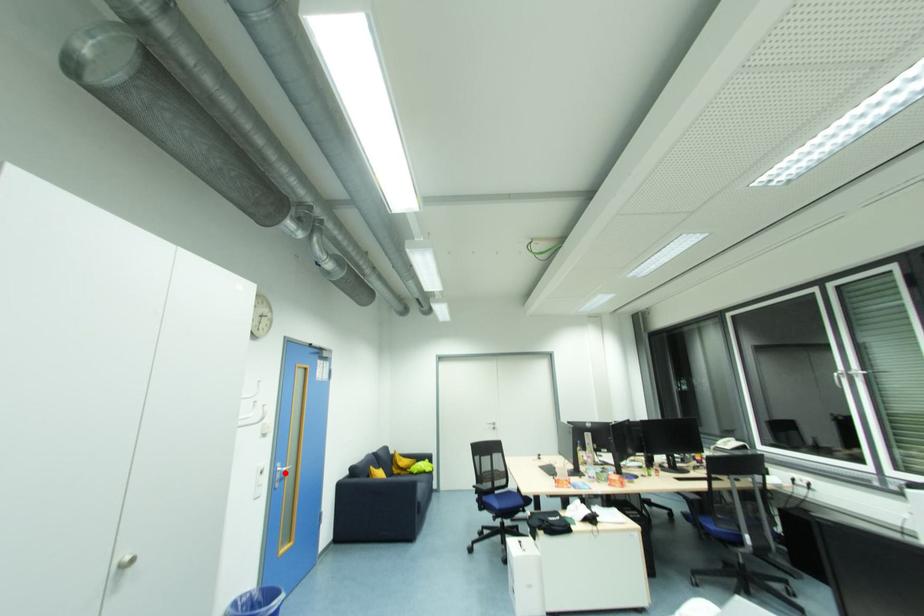
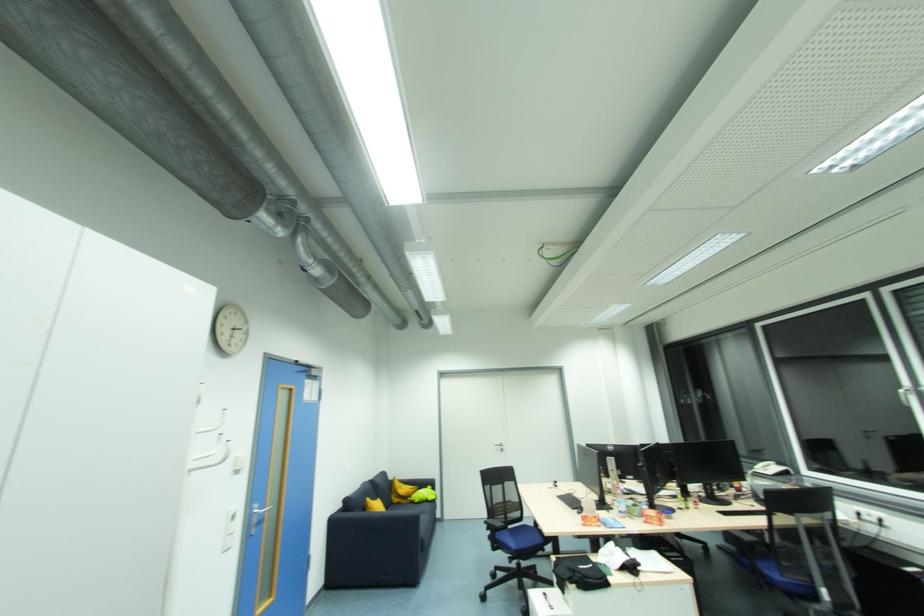
In the second image, find the point that corresponds to the highlighted location in the first image.

(261, 517)